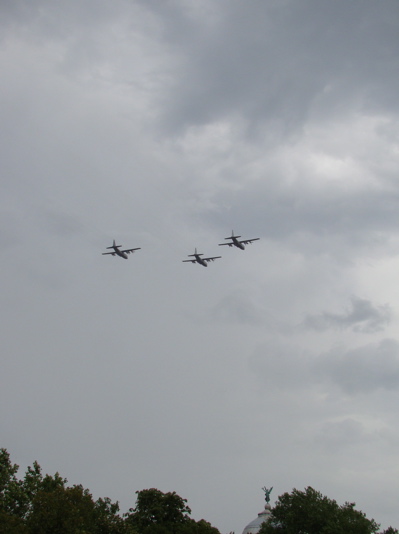
Image resolution: width=399 pixels, height=534 pixels. In order to click on statue in this screenshot , I will do `click(266, 486)`.